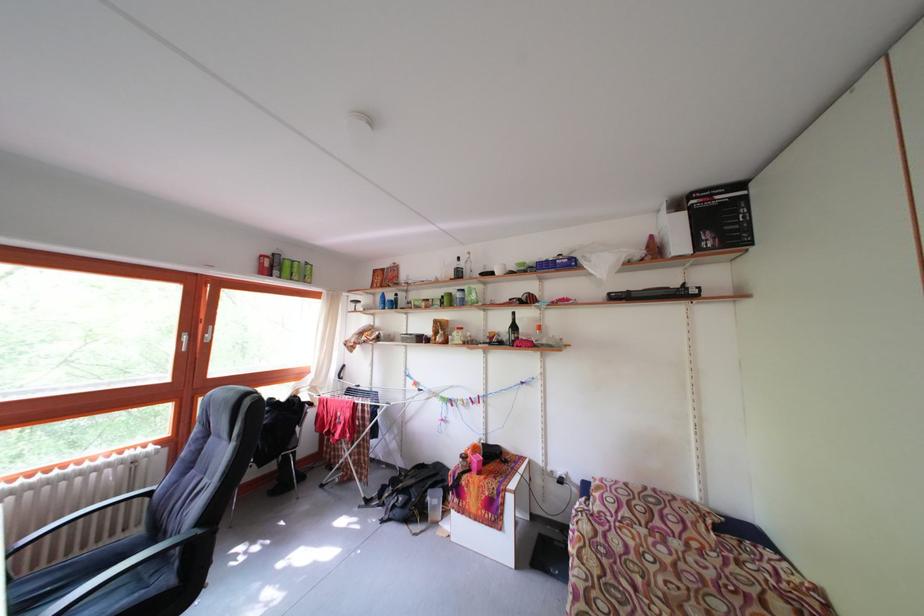
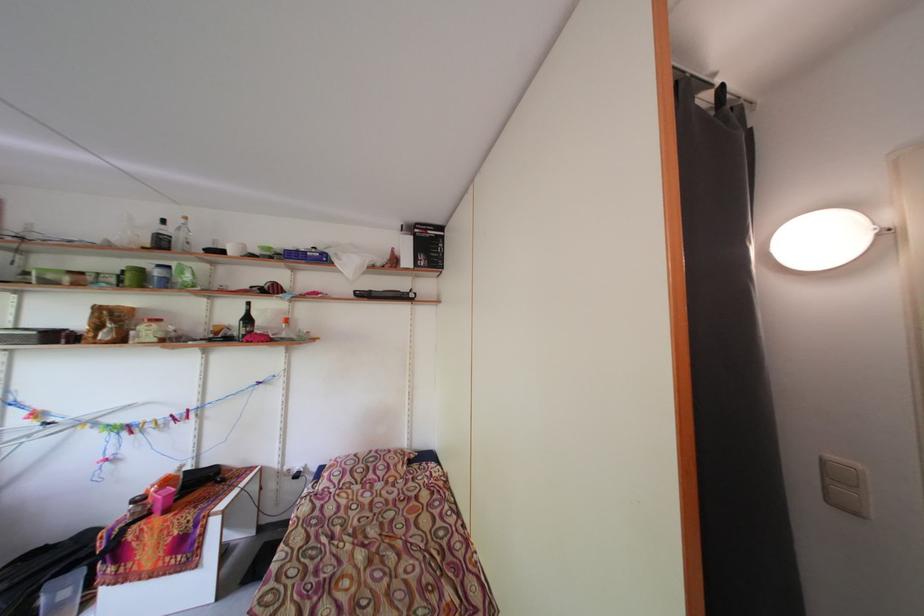
Find the pixel in the second image that matches (447,296) in the first image.

(127, 265)